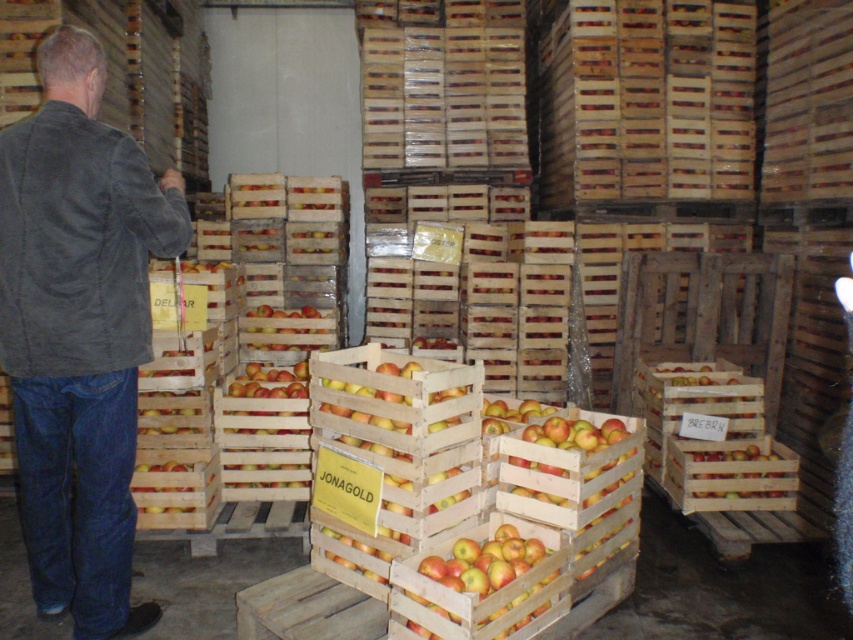
You are organizing a clothing store and need to place the dark gray corduroy jacket at left and the dark gray suede jacket at left on a shelf. Which jacket should you place on the left side of the shelf to match their current arrangement?

The dark gray corduroy jacket at left should be placed on the left side of the shelf because it is currently positioned on the left side of the dark gray suede jacket at left.

You are a warehouse worker who needs to retrieve the yellow matte apple at center. There is a dark gray suede jacket at left blocking your path. Can you reach the apple without moving the jacket?

The dark gray suede jacket at left is above the yellow matte apple at center, so you can reach the yellow matte apple at center without moving the jacket since it is positioned below the jacket.

Based on the photo, you are a warehouse worker who needs to place a new dark gray corduroy jacket at left and a dark gray suede jacket at left on a shelf. The shelf has limited space. Which jacket should you choose to place first to maximize space efficiency?

The dark gray suede jacket at left is smaller in size than the dark gray corduroy jacket at left, so placing the larger jacket first would leave space for the smaller one, maximizing space efficiency.